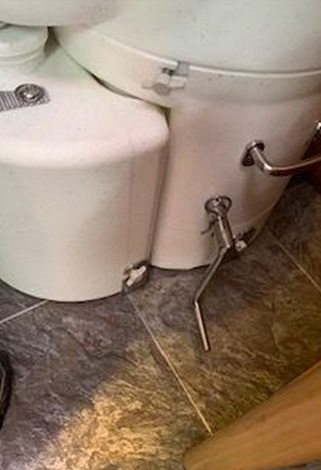
This screenshot has height=470, width=321. In order to click on tile in this screenshot , I will do `click(237, 371)`.